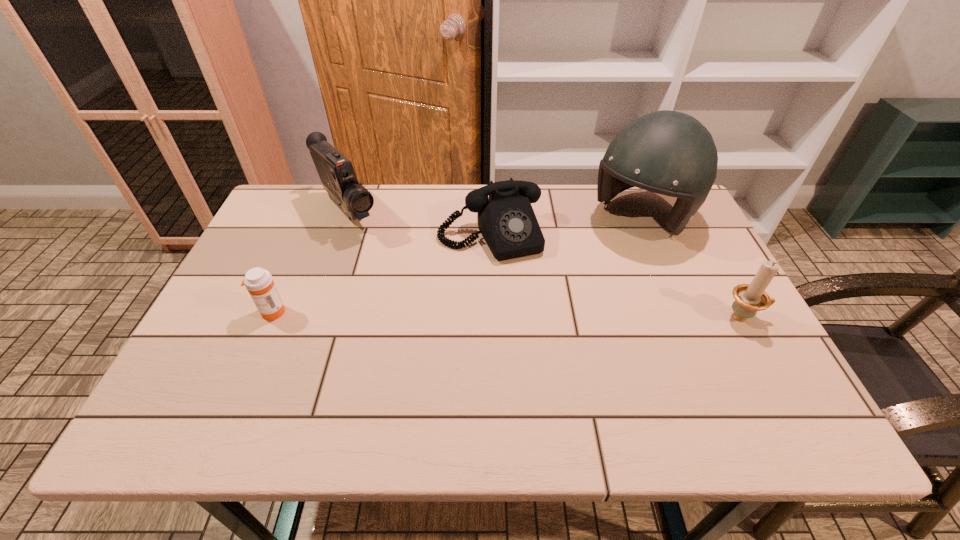
I want to click on vacant space situated at the face opening of the football helmet, so 606,254.

Locate an element on the screen. The image size is (960, 540). vacant space situated 0.320m at the face opening of the football helmet is located at coordinates (552, 308).

Where is `blank space located 0.070m on the front-facing side of the camcorder`? This screenshot has height=540, width=960. blank space located 0.070m on the front-facing side of the camcorder is located at coordinates (375, 250).

Find the location of a particular element. vacant space located 0.180m on the front-facing side of the camcorder is located at coordinates (396, 272).

This screenshot has width=960, height=540. In order to click on vacant region located 0.170m on the front-facing side of the camcorder in this screenshot , I will do 394,269.

Find the location of a particular element. This screenshot has height=540, width=960. telephone located in the far edge section of the desktop is located at coordinates click(x=506, y=220).

At what (x,y) coordinates should I click in order to perform the action: click on football helmet at the far edge. Please return your answer as a coordinate pair (x, y). The width and height of the screenshot is (960, 540). Looking at the image, I should click on (671, 153).

You are a GUI agent. You are given a task and a screenshot of the screen. Output one action in this format:
    pyautogui.click(x=<x>, y=<y>)
    Task: Click on the camcorder that is at the far edge
    The width and height of the screenshot is (960, 540).
    Given the screenshot: What is the action you would take?
    pyautogui.click(x=336, y=172)

The height and width of the screenshot is (540, 960). Identify the location of medicine located in the left edge section of the desktop. (259, 282).

In order to click on camcorder at the left edge in this screenshot , I will do `click(336, 172)`.